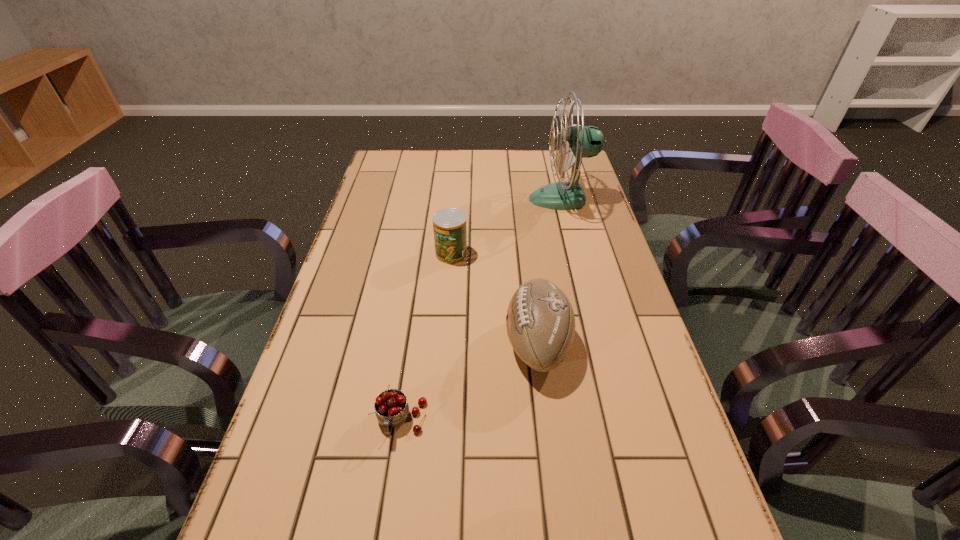
Where is `object that ranks as the second closest to the can`? object that ranks as the second closest to the can is located at coordinates (579, 142).

Choose which object is the nearest neighbor to the third nearest object. Please provide its 2D coordinates. Your answer should be formatted as a tuple, i.e. [(x, y)], where the tuple contains the x and y coordinates of a point satisfying the conditions above.

[(540, 322)]

What are the coordinates of `vacant space that satisfies the following two spatial constraints: 1. in front of the fan, directing airflow; 2. on the handle side of the shortest object` in the screenshot? It's located at (619, 421).